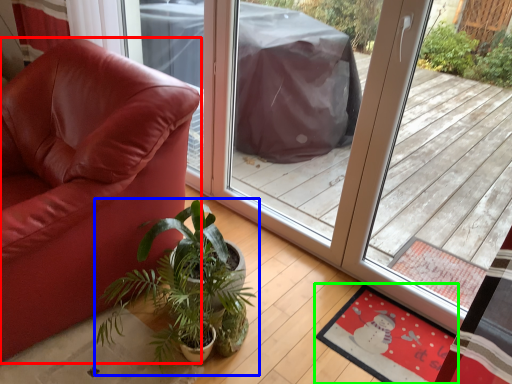
Question: Which object is positioned closest to chair (highlighted by a red box)? Select from houseplant (highlighted by a blue box) and mat (highlighted by a green box).

Choices:
 (A) houseplant
 (B) mat

Answer: (A)